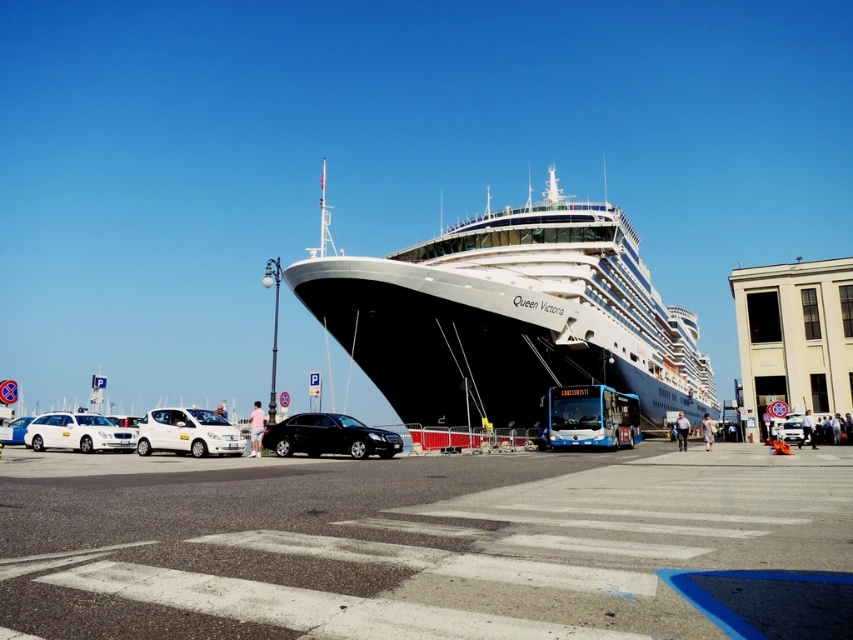
Measure the distance from white matte car at lower left to white matte station wagon at left.

white matte car at lower left is 7.40 meters from white matte station wagon at left.

Can you confirm if white matte car at lower left is wider than white matte station wagon at left?

Incorrect, white matte car at lower left's width does not surpass white matte station wagon at left's.

The image size is (853, 640). Find the location of `white matte car at lower left`. white matte car at lower left is located at coordinates pos(187,433).

I want to click on white matte car at lower left, so click(187, 433).

Is shiny black sedan at center to the right of white glossy sedan at center-left from the viewer's perspective?

Yes, shiny black sedan at center is to the right of white glossy sedan at center-left.

Is shiny black sedan at center positioned before white glossy sedan at center-left?

Yes, it is in front of white glossy sedan at center-left.

Does point (320, 436) lie behind point (22, 422)?

No, it is not.

Find the location of a particular element. This screenshot has height=640, width=853. shiny black sedan at center is located at coordinates (329, 436).

Can you confirm if white glossy cruise ship at center is shorter than white matte car at lower left?

No.

Is white glossy cruise ship at center closer to the viewer compared to white matte car at lower left?

No, white glossy cruise ship at center is further to the viewer.

Is point (595, 376) closer to camera compared to point (183, 429)?

No, it is behind (183, 429).

Where is `white glossy cruise ship at center`? The height and width of the screenshot is (640, 853). white glossy cruise ship at center is located at coordinates (509, 316).